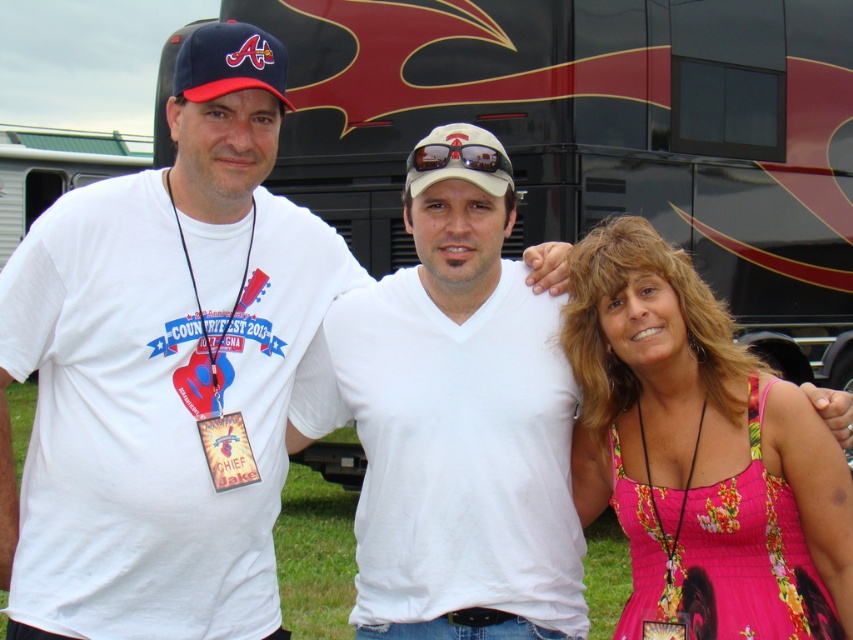
Does point (538, 358) come farther from viewer compared to point (260, 76)?

Yes, point (538, 358) is behind point (260, 76).

Does white matte t-shirt at center have a lesser width compared to matte fabric baseball cap at upper left?

In fact, white matte t-shirt at center might be wider than matte fabric baseball cap at upper left.

Which is in front, point (500, 266) or point (254, 54)?

Point (254, 54)

Where is `white matte t-shirt at center`? The width and height of the screenshot is (853, 640). white matte t-shirt at center is located at coordinates (453, 419).

Between white matte t-shirt at center and white matte baseball cap at center, which one appears on the left side from the viewer's perspective?

From the viewer's perspective, white matte t-shirt at center appears more on the left side.

Is point (444, 284) positioned after point (486, 132)?

Yes, it is.

You are a GUI agent. You are given a task and a screenshot of the screen. Output one action in this format:
    pyautogui.click(x=<x>, y=<y>)
    Task: Click on the white matte t-shirt at center
    The width and height of the screenshot is (853, 640).
    Given the screenshot: What is the action you would take?
    pyautogui.click(x=453, y=419)

Between pink floral dress at center and matte fabric baseball cap at upper left, which one has more height?

With more height is pink floral dress at center.

Is pink floral dress at center wider than matte fabric baseball cap at upper left?

Yes, pink floral dress at center is wider than matte fabric baseball cap at upper left.

Is point (611, 500) more distant than point (282, 49)?

Yes, point (611, 500) is farther from viewer.

The image size is (853, 640). I want to click on pink floral dress at center, so (692, 449).